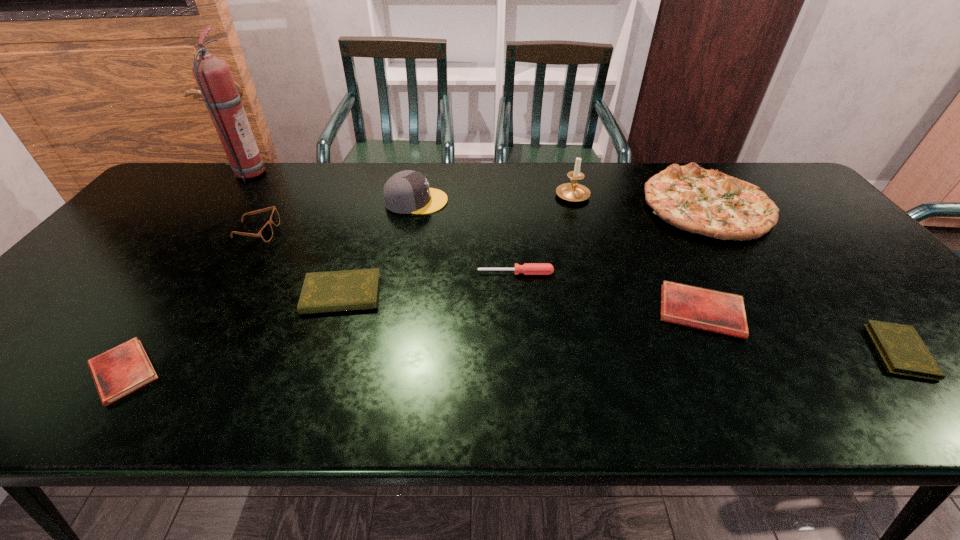
You are a GUI agent. You are given a task and a screenshot of the screen. Output one action in this format:
    pyautogui.click(x=<x>, y=<y>)
    Task: Click on the free space between the leftmost diary and the fourth tallest object
    The height and width of the screenshot is (540, 960).
    Given the screenshot: What is the action you would take?
    pyautogui.click(x=415, y=288)

Locate an element on the screen. The width and height of the screenshot is (960, 540). free space that is in between the left green diary and the ninth shortest object is located at coordinates click(457, 244).

You are a GUI agent. You are given a task and a screenshot of the screen. Output one action in this format:
    pyautogui.click(x=<x>, y=<y>)
    Task: Click on the fifth closest object relative to the second diary from right to left
    
    Given the screenshot: What is the action you would take?
    pyautogui.click(x=407, y=191)

In order to click on the seventh closest object to the right red diary in this screenshot , I will do `click(266, 233)`.

Locate an element on the screen. diary that can be found as the closest to the seventh shortest object is located at coordinates (720, 312).

The width and height of the screenshot is (960, 540). In order to click on the second closest diary relative to the pizza in this screenshot , I will do `click(902, 349)`.

Find the location of a particular element. This screenshot has height=540, width=960. free space that satisfies the following two spatial constraints: 1. on the front-facing side of the seventh shortest object; 2. on the right side of the third tallest object is located at coordinates (416, 205).

At what (x,y) coordinates should I click in order to perform the action: click on free space that satisfies the following two spatial constraints: 1. on the frames of the fifth tallest object; 2. on the right side of the right red diary. Please return your answer as a coordinate pair (x, y). This screenshot has width=960, height=540. Looking at the image, I should click on coord(207,312).

Where is `vacant point that satisfies the following two spatial constraints: 1. on the frames of the sunglasses; 2. on the right side of the second diary from right to left`? vacant point that satisfies the following two spatial constraints: 1. on the frames of the sunglasses; 2. on the right side of the second diary from right to left is located at coordinates (207, 312).

The width and height of the screenshot is (960, 540). Identify the location of free space that satisfies the following two spatial constraints: 1. on the front-facing side of the third tallest object; 2. on the left side of the third diary from left to right. (396, 312).